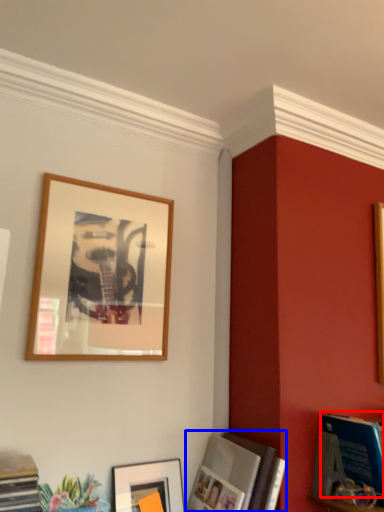
Question: Among these objects, which one is farthest to the camera, magazine (highlighted by a red box) or picture frame (highlighted by a blue box)?

Choices:
 (A) magazine
 (B) picture frame

Answer: (A)